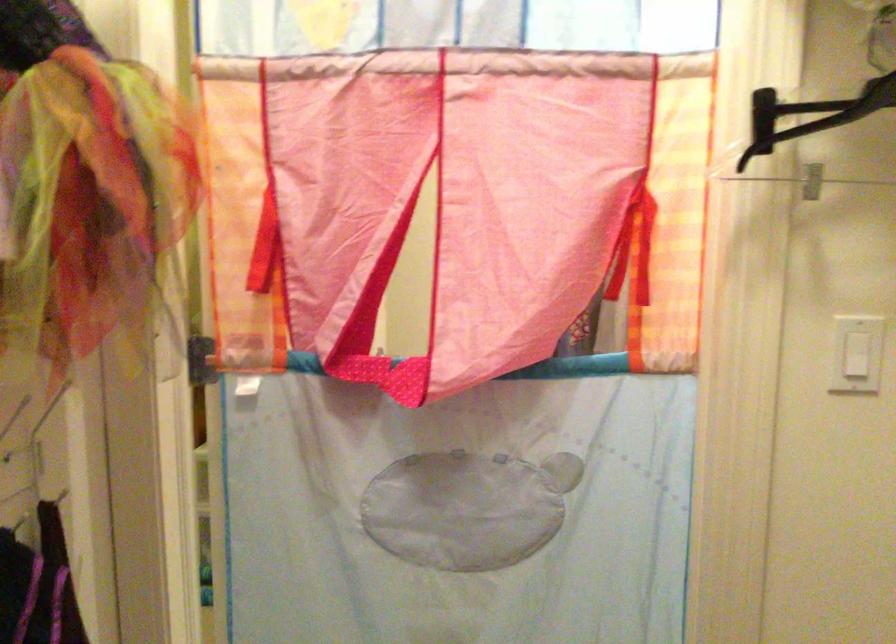
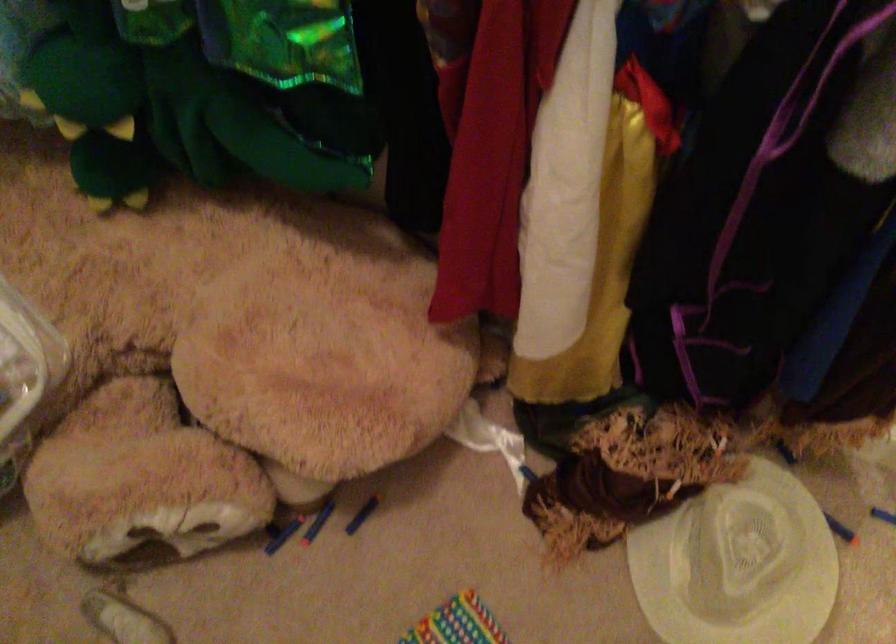
The images are taken continuously from a first-person perspective. In which direction is your viewpoint rotating?

The camera's rotation is toward left-down.